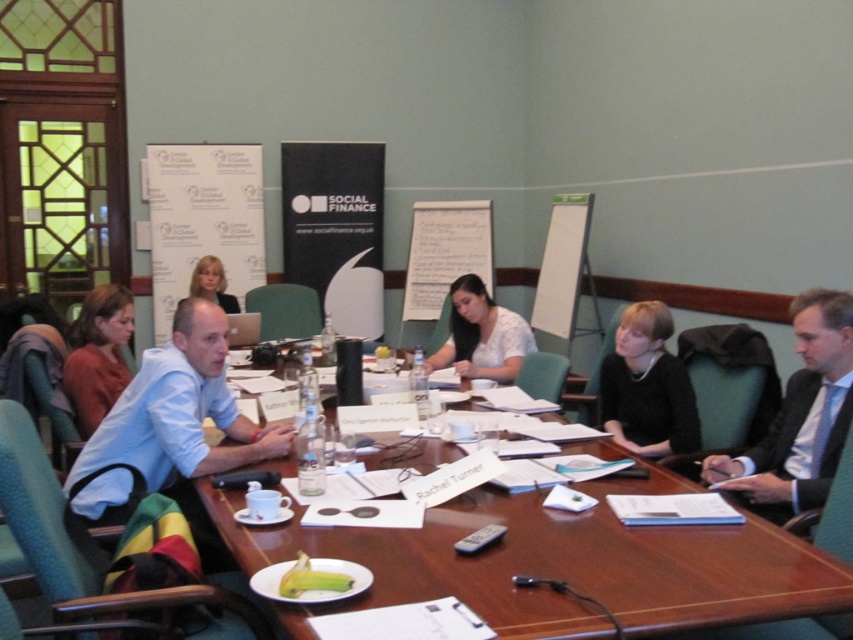
You are organizing a photo shoot for a fashion magazine and need to arrange two outfits in a photo. The outfits are the light blue suit at right and the black matte dress at center. Which outfit requires more space to display properly?

The light blue suit at right requires more space to display properly because it is bigger than the black matte dress at center.

You are standing at the point marked as point (819,360) in the image. You want to greet someone who is 2 meters away from you. Can you reach them without moving?

The distance between you and the viewer is 2.44 meters. Since you want to greet someone 2 meters away, you can reach them without moving as 2.44 meters is greater than 2 meters.